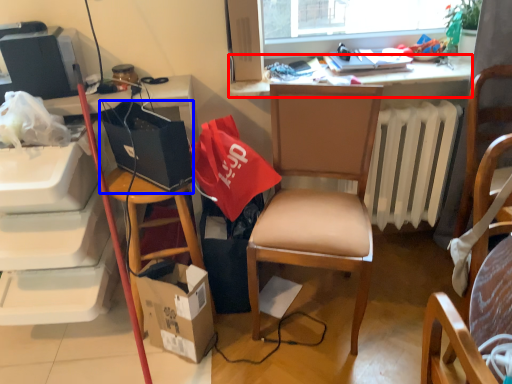
Question: Among these objects, which one is nearest to the camera, desk (highlighted by a red box) or handbag (highlighted by a blue box)?

Choices:
 (A) desk
 (B) handbag

Answer: (B)